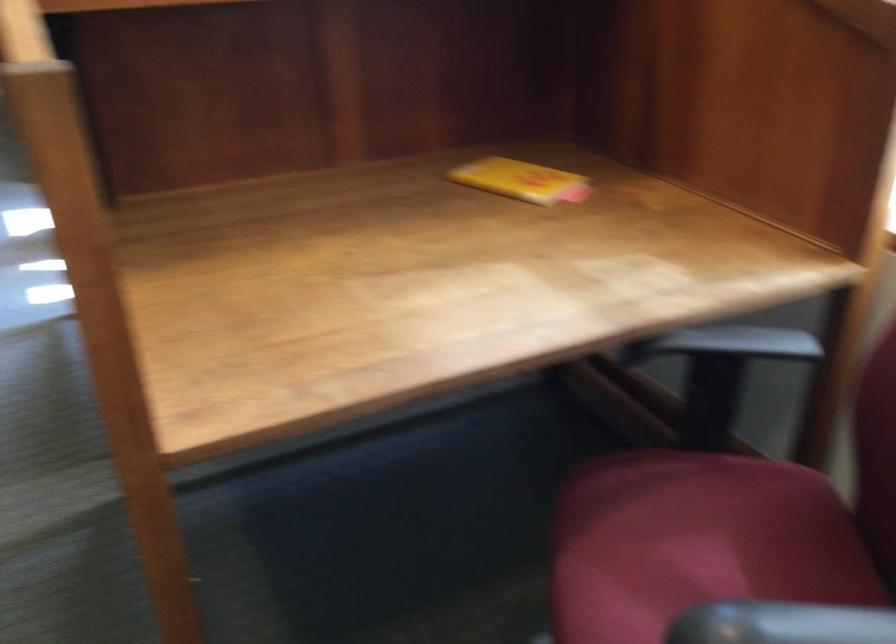
This screenshot has height=644, width=896. Describe the element at coordinates (694, 554) in the screenshot. I see `a red chair sitting surface` at that location.